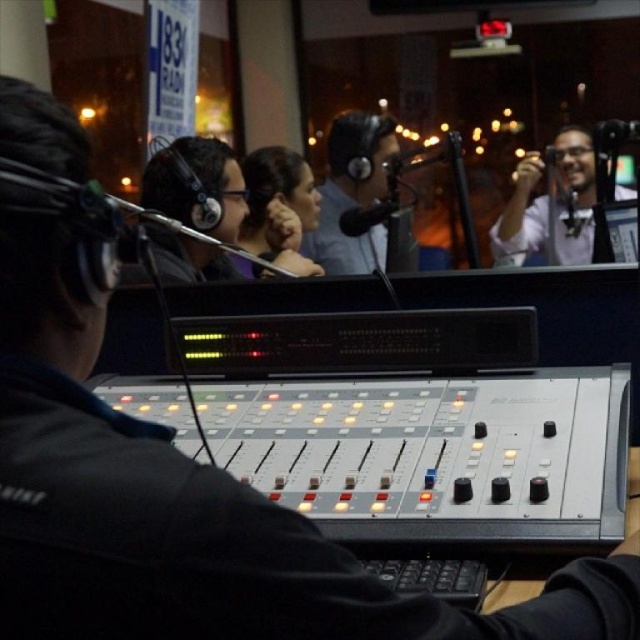
You are a technician in the radio studio and need to adjust the settings on the matte black camera at upper right and the matte black headphones at center. Which object do you need to reach first to make adjustments?

You need to adjust the matte black camera at upper right first because it is closer to you than the matte black headphones at center.

You are a technician in the radio studio and need to adjust the matte black camera at upper right and the matte black headphones at center. Which object should you move first if you want to start with the one closer to the right side of the studio?

The matte black camera at upper right is to the right of the matte black headphones at center, so you should adjust the matte black camera at upper right first since it is closer to the right side of the studio.

You are a technician in the radio studio and need to adjust the two points on the mixing console. Which point is closer to you, point at position (595, 188) or point at position (288, 172)?

Point at position (595, 188) is closer to you than point at position (288, 172).